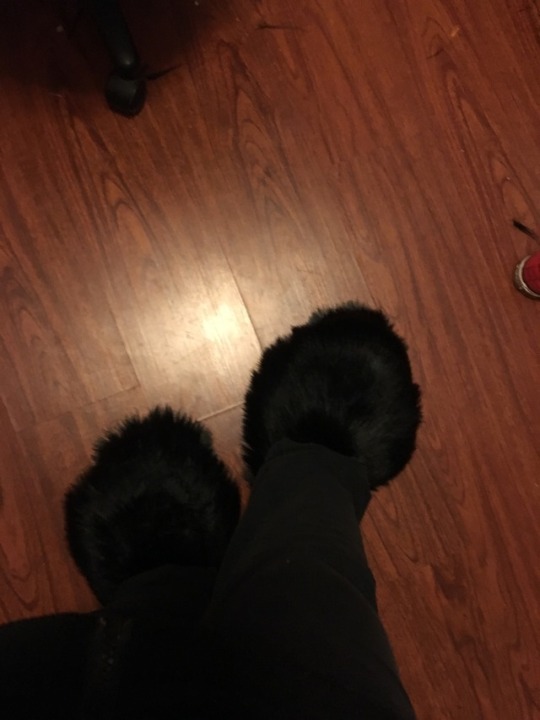
Find the location of `wood floor, brown`. wood floor, brown is located at coordinates point(229,428).